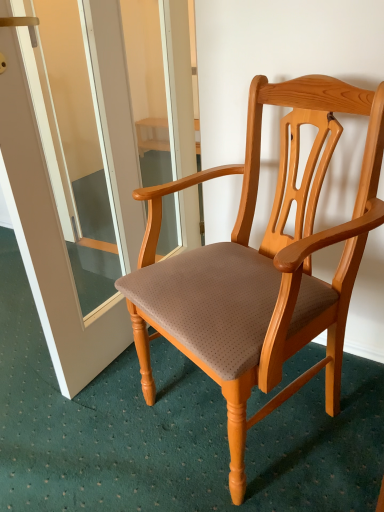
Find the location of a particular element. This screenshot has height=512, width=384. free space in front of transparent glass screen door at center is located at coordinates (110, 423).